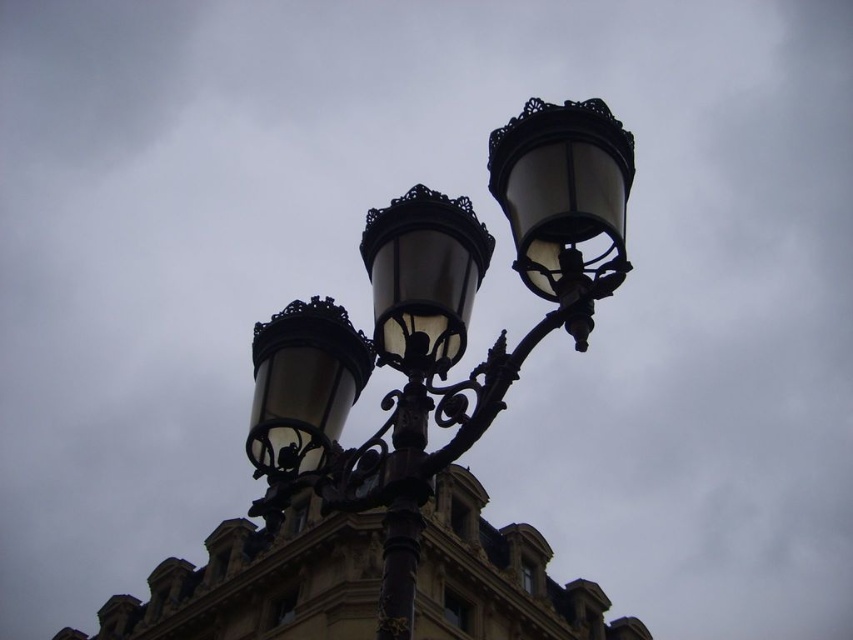
You are a city planner evaluating the placement of two matte black street light at center and matte black lamp at upper right. Considering their heights, which one would cast a longer shadow during the evening?

The matte black street light at center is much taller than the matte black lamp at upper right, so it would cast a longer shadow during the evening.

You are a city planner assessing the placement of the matte black lamp at upper right and the black wrought iron pole at center. Considering their sizes, which object would cast a larger shadow during the evening?

The matte black lamp at upper right is bigger than the black wrought iron pole at center, so it would cast a larger shadow during the evening.

You are a city planner assessing the placement of two matte black street light at center and matte black lamp at upper right. Given their widths, which one would require more horizontal space between them to avoid obstruction?

The matte black street light at center has a greater width than the matte black lamp at upper right, so it would require more horizontal space between them to avoid obstruction.